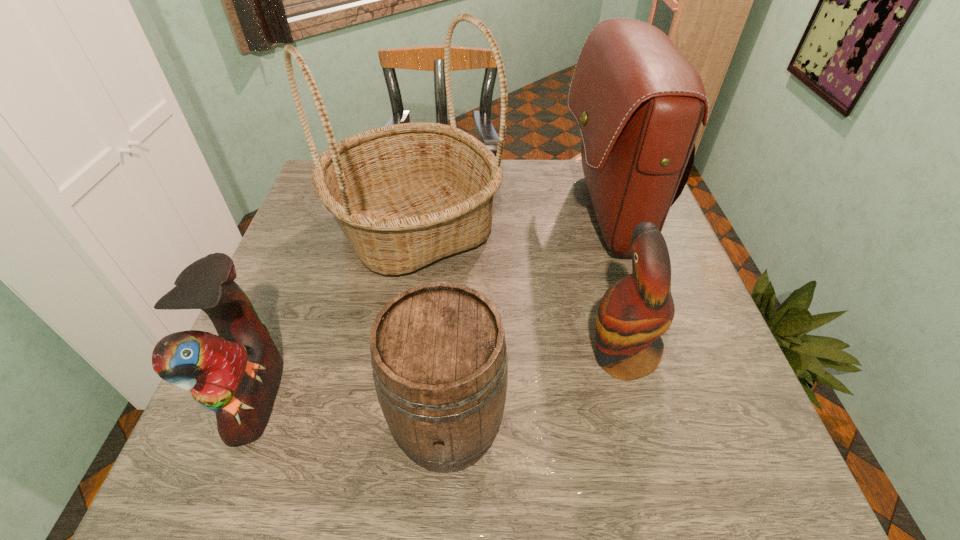
Where is `vacant space located 0.050m on the face of the right parrot`? The width and height of the screenshot is (960, 540). vacant space located 0.050m on the face of the right parrot is located at coordinates (560, 355).

Where is `vacant position located on the face of the right parrot`? The image size is (960, 540). vacant position located on the face of the right parrot is located at coordinates (519, 355).

Identify the location of vacant space situated 0.060m at the face of the left parrot. (313, 396).

At what (x,y) coordinates should I click in order to perform the action: click on basket present at the far edge. Please return your answer as a coordinate pair (x, y). Looking at the image, I should click on (406, 195).

You are a GUI agent. You are given a task and a screenshot of the screen. Output one action in this format:
    pyautogui.click(x=<x>, y=<y>)
    Task: Click on the satchel that is at the far edge
    The image size is (960, 540).
    Given the screenshot: What is the action you would take?
    pyautogui.click(x=638, y=101)

Locate an element on the screen. parrot at the near edge is located at coordinates (237, 373).

I want to click on cider present at the near edge, so click(x=438, y=352).

You are a GUI agent. You are given a task and a screenshot of the screen. Output one action in this format:
    pyautogui.click(x=<x>, y=<y>)
    Task: Click on the basket that is at the left edge
    
    Given the screenshot: What is the action you would take?
    [406, 195]

I want to click on parrot located at the left edge, so click(237, 373).

This screenshot has height=540, width=960. I want to click on satchel positioned at the right edge, so click(638, 101).